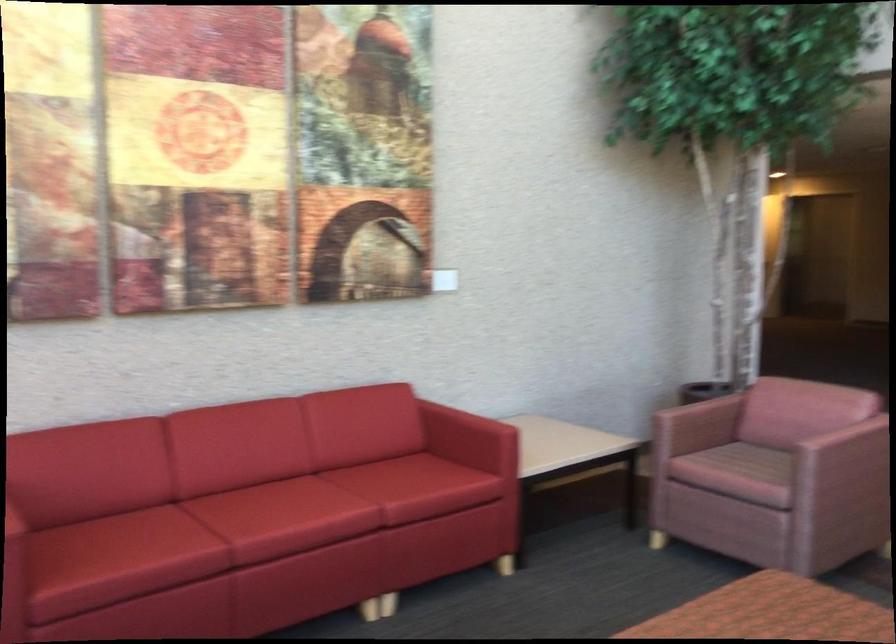
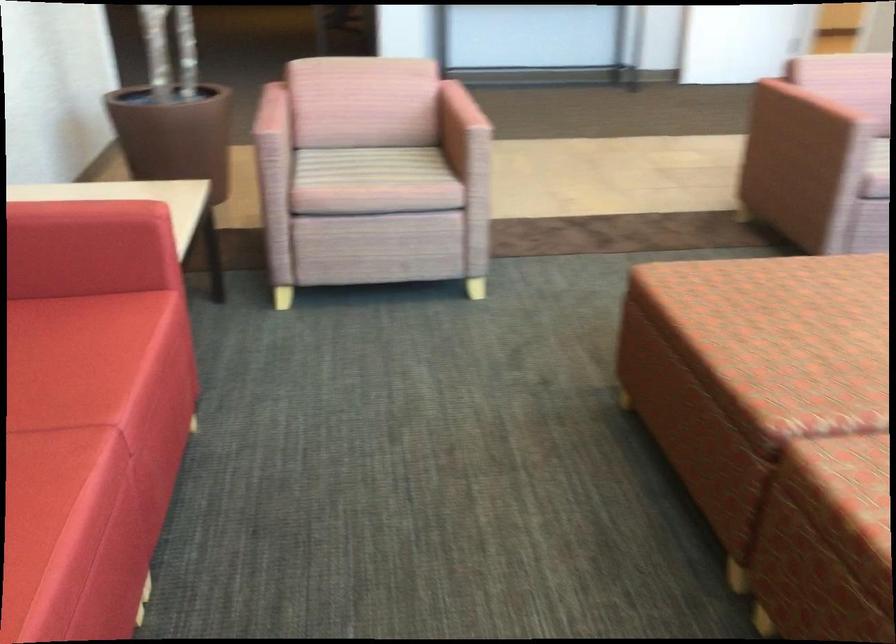
Locate, in the second image, the point that corresponds to the point at 814,437 in the first image.

(459, 118)